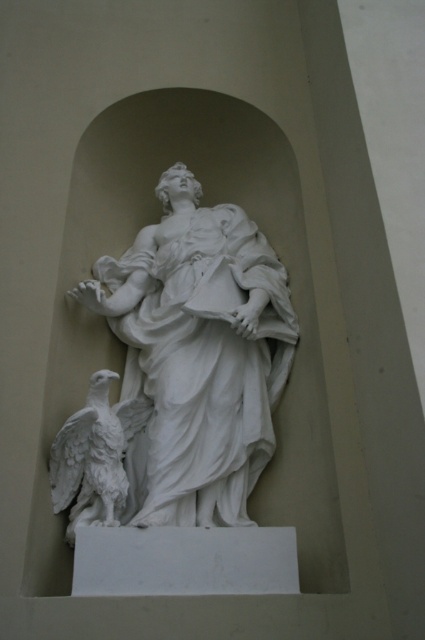
Can you confirm if white marble statue at center is positioned to the right of white marble eagle at lower left?

Indeed, white marble statue at center is positioned on the right side of white marble eagle at lower left.

Can you confirm if white marble statue at center is shorter than white marble eagle at lower left?

No.

You are a GUI agent. You are given a task and a screenshot of the screen. Output one action in this format:
    pyautogui.click(x=<x>, y=<y>)
    Task: Click on the white marble statue at center
    Image resolution: width=425 pixels, height=640 pixels.
    Given the screenshot: What is the action you would take?
    pyautogui.click(x=198, y=355)

What are the coordinates of `white marble statue at center` in the screenshot? It's located at (198, 355).